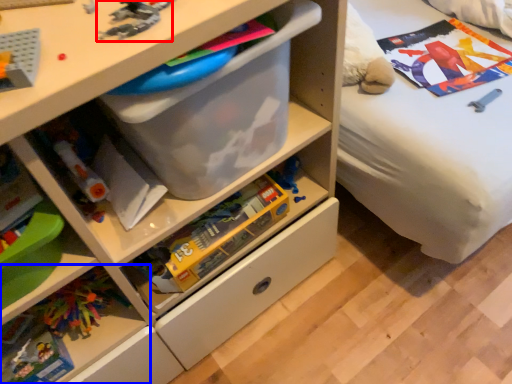
Question: Among these objects, which one is nearest to the camera, toy (highlighted by a red box) or shelf (highlighted by a blue box)?

Choices:
 (A) toy
 (B) shelf

Answer: (A)